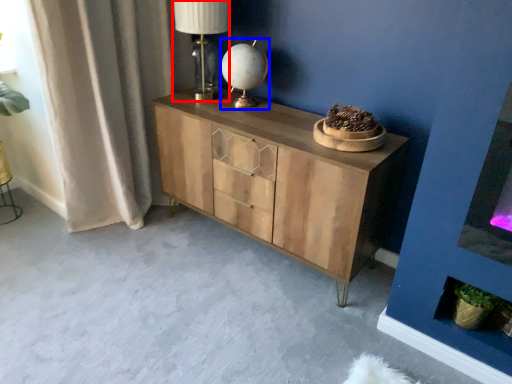
Question: Which object appears farthest to the camera in this image, table lamp (highlighted by a red box) or table lamp (highlighted by a blue box)?

Choices:
 (A) table lamp
 (B) table lamp

Answer: (B)